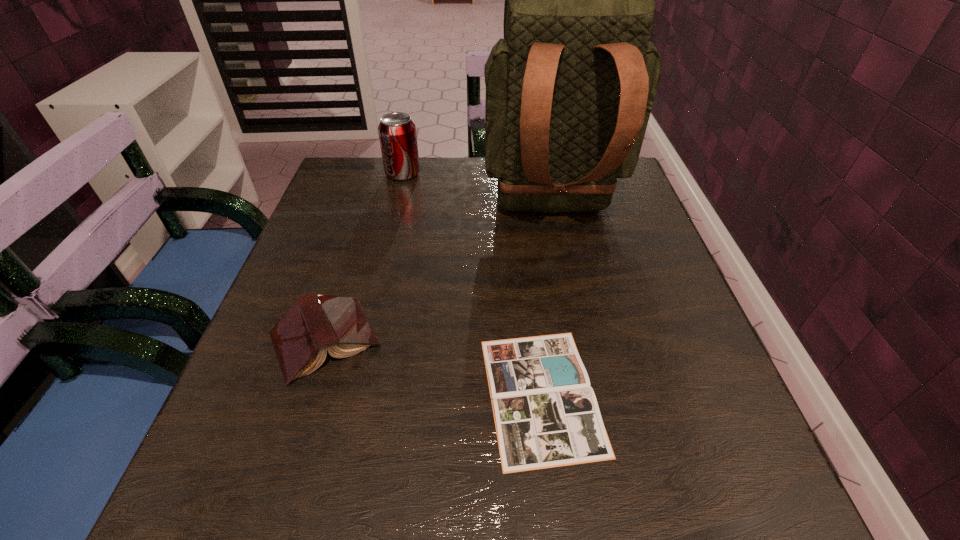
This screenshot has width=960, height=540. I want to click on backpack, so click(x=569, y=90).

In order to click on the second tallest object in this screenshot , I will do `click(397, 134)`.

At what (x,y) coordinates should I click in order to perform the action: click on the left book. Please return your answer as a coordinate pair (x, y). The width and height of the screenshot is (960, 540). Looking at the image, I should click on (315, 323).

At what (x,y) coordinates should I click in order to perform the action: click on the third tallest object. Please return your answer as a coordinate pair (x, y). This screenshot has height=540, width=960. Looking at the image, I should click on (315, 323).

Where is `the shortest object`? The width and height of the screenshot is (960, 540). the shortest object is located at coordinates (546, 414).

The width and height of the screenshot is (960, 540). I want to click on the shorter book, so click(x=546, y=414).

The width and height of the screenshot is (960, 540). What are the coordinates of `vacant space located on the back of the backpack` in the screenshot? It's located at (583, 362).

At what (x,y) coordinates should I click in order to perform the action: click on free spot located on the right of the second tallest object. Please return your answer as a coordinate pair (x, y). The height and width of the screenshot is (540, 960). Looking at the image, I should click on (480, 173).

You are a GUI agent. You are given a task and a screenshot of the screen. Output one action in this format:
    pyautogui.click(x=<x>, y=<y>)
    Task: Click on the free space located 0.100m on the front of the third tallest object
    Image resolution: width=960 pixels, height=540 pixels.
    Given the screenshot: What is the action you would take?
    pos(291,447)

At what (x,y) coordinates should I click in order to perform the action: click on vacant region located on the back of the shorter book. Please return your answer as a coordinate pair (x, y). This screenshot has width=960, height=540. Looking at the image, I should click on (524, 241).